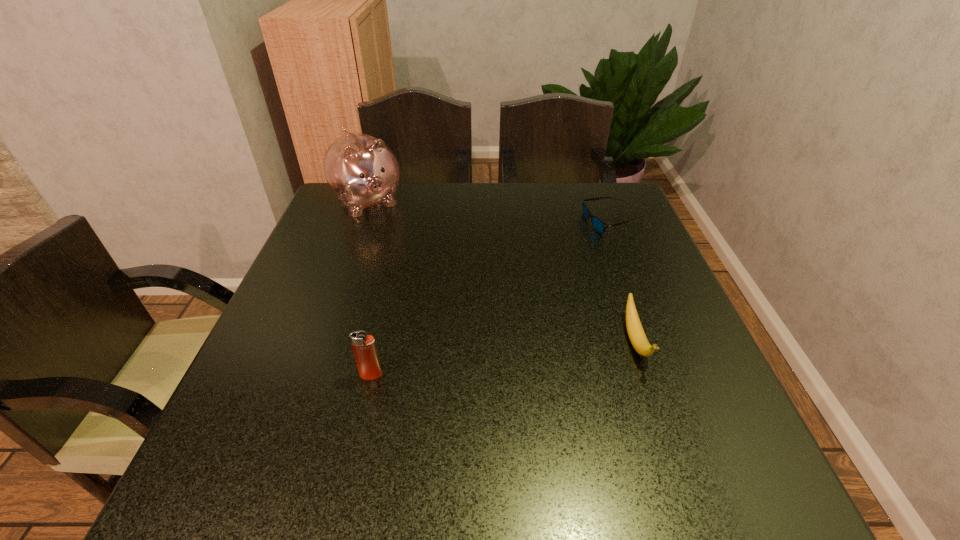
Identify the location of vacant area situated on the front facing side of the tallest object. Image resolution: width=960 pixels, height=540 pixels. click(x=408, y=255).

Identify the location of vacant region located on the front facing side of the tallest object. (410, 257).

In order to click on sunglasses that is at the far edge in this screenshot , I will do `click(599, 225)`.

Identify the location of piggy bank that is at the far edge. The height and width of the screenshot is (540, 960). (361, 170).

Find the location of a particular element. object located at the left edge is located at coordinates (361, 170).

Where is `banana located in the right edge section of the desktop`? banana located in the right edge section of the desktop is located at coordinates (636, 334).

Locate an element on the screen. sunglasses situated at the right edge is located at coordinates (599, 225).

Find the location of a particular element. The height and width of the screenshot is (540, 960). object located in the far left corner section of the desktop is located at coordinates (361, 170).

This screenshot has width=960, height=540. In order to click on object that is at the far right corner in this screenshot , I will do `click(599, 225)`.

In the image, there is a desktop. Where is `free space at the far edge`? The width and height of the screenshot is (960, 540). free space at the far edge is located at coordinates (453, 191).